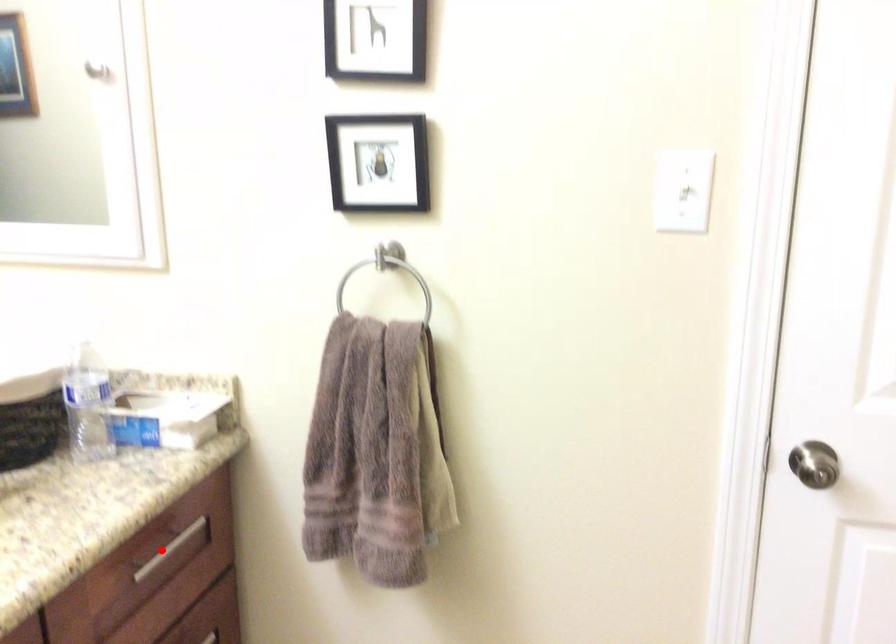
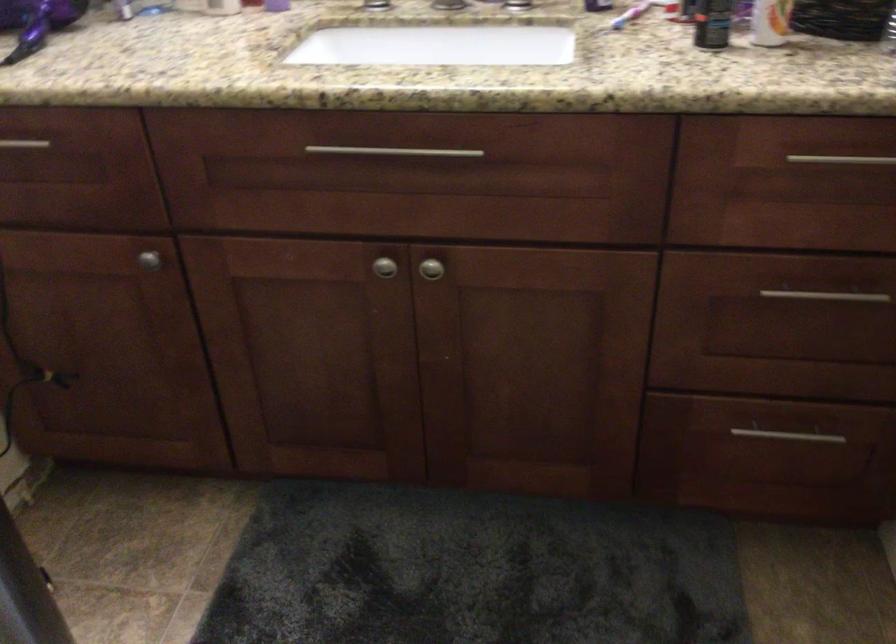
Where in the second image is the point corresponding to the highlighted location from the first image?

(841, 158)